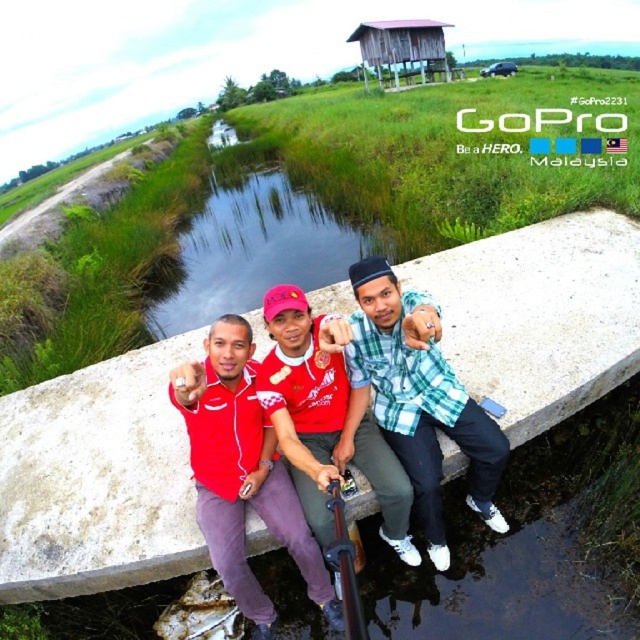
Does point (429, 516) come behind point (285, 529)?

Yes, it is.

Who is more forward, (468,460) or (266,483)?

Point (266,483) is in front.

Locate an element on the screen. Image resolution: width=640 pixels, height=640 pixels. checkered fabric shirt at center is located at coordinates (417, 400).

Is checkered fabric shirt at center positioned in front of wooden stilt house at upper center?

Yes, it is in front of wooden stilt house at upper center.

Does checkered fabric shirt at center have a greater width compared to wooden stilt house at upper center?

Incorrect, checkered fabric shirt at center's width does not surpass wooden stilt house at upper center's.

Which is in front, point (412, 358) or point (394, 52)?

Point (412, 358) is in front.

This screenshot has width=640, height=640. I want to click on checkered fabric shirt at center, so coord(417,400).

Measure the distance from white concrete ledge at center to wooden stilt house at upper center.

white concrete ledge at center and wooden stilt house at upper center are 42.58 meters apart.

Is point (545, 387) positioned in front of point (349, 36)?

Yes, point (545, 387) is in front of point (349, 36).

Which is behind, point (145, 413) or point (442, 36)?

The point (442, 36) is behind.

Locate an element on the screen. This screenshot has width=640, height=640. white concrete ledge at center is located at coordinates (97, 480).